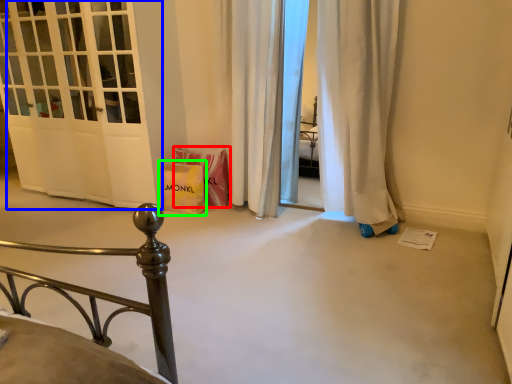
Question: Which object is the closest to the material (highlighted by a red box)? Choose among these: door (highlighted by a blue box) or gift bag (highlighted by a green box).

Choices:
 (A) door
 (B) gift bag

Answer: (B)